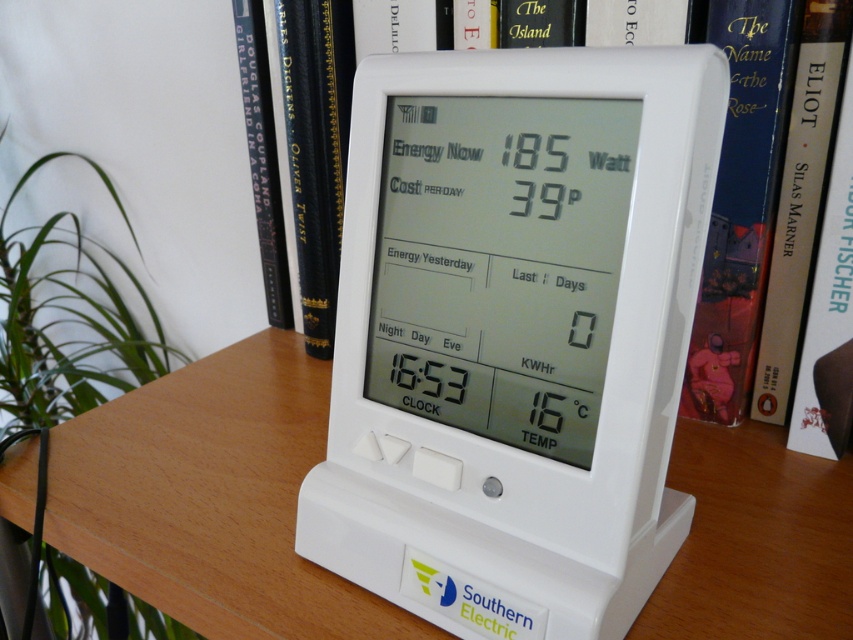
You are organizing items on a desk and need to place a white plastic thermometer at center and a hardcover book at upper center. According to the scene description, where should you position them relative to each other?

The white plastic thermometer at center should be placed below the hardcover book at upper center.

You are organizing a science fair project and need to place both the white plastic thermometer at center and the white plastic table at center on a display board. Given their sizes, which object should you draw larger to accurately represent their real sizes?

The white plastic thermometer at center occupies less space than the white plastic table at center, so you should draw the white plastic thermometer at center smaller and the white plastic table at center larger to accurately represent their real sizes.

You are organizing items on a desk and need to place both the white plastic thermometer at center and the hardcover book at upper right. Since the desk space is limited, which object should you move to make room for a new item that requires more space?

You should move the hardcover book at upper right because the white plastic thermometer at center is in front of it, meaning the book is further back and can be shifted to create more space.